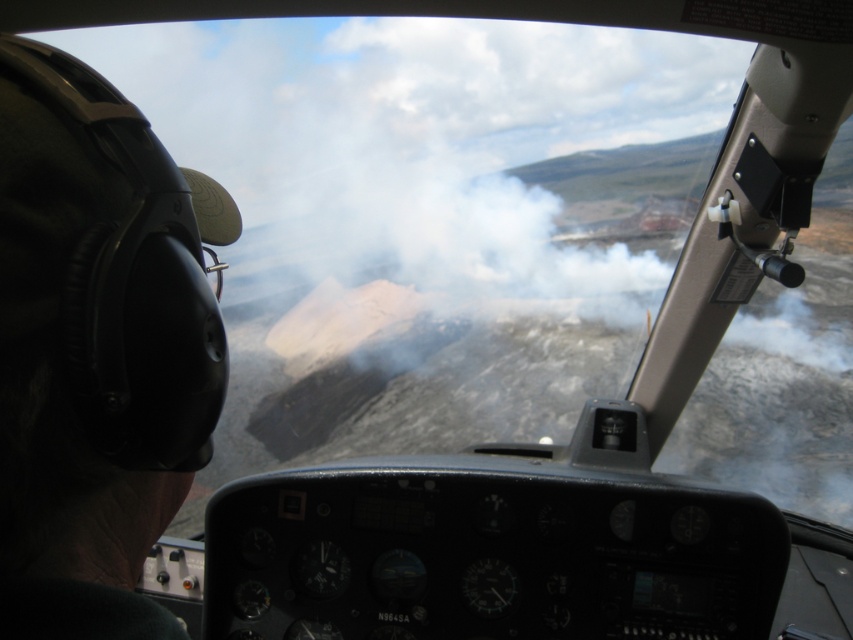
Question: Does black matte helmet at left appear under white fluffy cloud at upper center?

Choices:
 (A) yes
 (B) no

Answer: (A)

Question: Does black matte helmet at left appear on the right side of white fluffy cloud at upper center?

Choices:
 (A) yes
 (B) no

Answer: (B)

Question: Can you confirm if black matte helmet at left is wider than white fluffy cloud at upper center?

Choices:
 (A) yes
 (B) no

Answer: (B)

Question: Which point appears farthest from the camera in this image?

Choices:
 (A) (206, 392)
 (B) (322, 125)

Answer: (B)

Question: Which point is farther to the camera?

Choices:
 (A) (590, 35)
 (B) (56, 118)

Answer: (A)